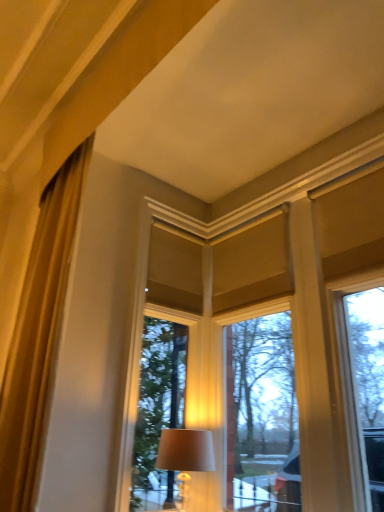
Question: Considering the relative sizes of matte beige lampshade at center and gold silky curtain at left in the image provided, is matte beige lampshade at center wider than gold silky curtain at left?

Choices:
 (A) yes
 (B) no

Answer: (B)

Question: Is matte beige lampshade at center smaller than gold silky curtain at left?

Choices:
 (A) yes
 (B) no

Answer: (A)

Question: Is matte beige lampshade at center taller than gold silky curtain at left?

Choices:
 (A) yes
 (B) no

Answer: (B)

Question: Is matte beige lampshade at center closer to camera compared to gold silky curtain at left?

Choices:
 (A) no
 (B) yes

Answer: (A)

Question: From the image's perspective, is matte beige lampshade at center below gold silky curtain at left?

Choices:
 (A) no
 (B) yes

Answer: (B)

Question: Is point (370, 365) positioned closer to the camera than point (18, 338)?

Choices:
 (A) closer
 (B) farther

Answer: (B)

Question: Considering the positions of matte cream window at center and gold silky curtain at left in the image, is matte cream window at center bigger or smaller than gold silky curtain at left?

Choices:
 (A) small
 (B) big

Answer: (B)

Question: From a real-world perspective, is matte cream window at center above or below gold silky curtain at left?

Choices:
 (A) above
 (B) below

Answer: (B)

Question: In terms of height, does matte cream window at center look taller or shorter compared to gold silky curtain at left?

Choices:
 (A) short
 (B) tall

Answer: (B)

Question: Does point (200, 431) appear closer or farther from the camera than point (44, 342)?

Choices:
 (A) farther
 (B) closer

Answer: (A)

Question: Is matte beige lampshade at center in front of or behind gold silky curtain at left in the image?

Choices:
 (A) front
 (B) behind

Answer: (B)

Question: Is matte beige lampshade at center spatially inside gold silky curtain at left, or outside of it?

Choices:
 (A) outside
 (B) inside

Answer: (A)

Question: In terms of size, does matte beige lampshade at center appear bigger or smaller than gold silky curtain at left?

Choices:
 (A) small
 (B) big

Answer: (A)

Question: Does point (155, 440) appear closer or farther from the camera than point (210, 452)?

Choices:
 (A) closer
 (B) farther

Answer: (B)

Question: Relative to matte beige lampshade at center, is matte cream window at center in front or behind?

Choices:
 (A) behind
 (B) front

Answer: (B)